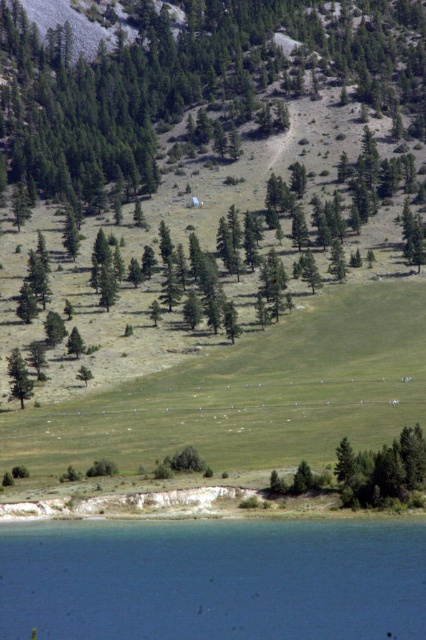
You are standing at the edge of the blue liquid water at lower center and want to walk towards the green leafy tree at center. In which direction should you head?

You should head to the right side since the green leafy tree at center is positioned on the right side of the blue liquid water at lower center.

You are standing at the edge of the water in the image. Which object is directly above you, the green leafy tree at center or the blue liquid water at lower center?

The green leafy tree at center is directly above the blue liquid water at lower center, so if you are standing at the edge of the water, the green leafy tree at center is above you.

You are standing at the edge of the blue liquid water at lower center and want to walk to the green matte tree at left. Given that your average walking pace is 1.5 meters per second, approximately how many seconds will it take you to reach the tree?

The distance between the blue liquid water at lower center and the green matte tree at left is 70.10 meters. At a pace of 1.5 meters per second, dividing the distance by the speed gives approximately 46.73 seconds. Rounding to the nearest whole number, it would take about 47 seconds to reach the tree.